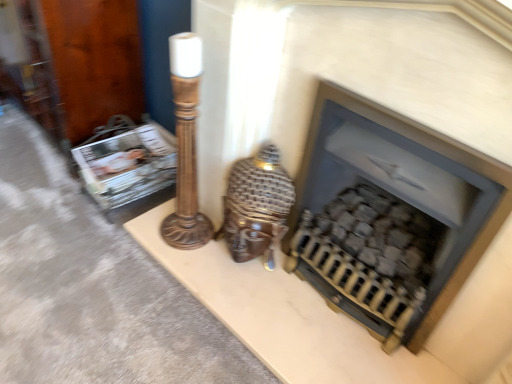
The width and height of the screenshot is (512, 384). Find the location of `free location to the left of matte plastic magazine at left`. free location to the left of matte plastic magazine at left is located at coordinates (59, 178).